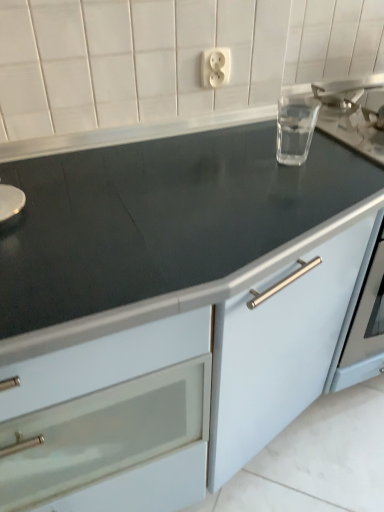
Find the location of `spots to the right of transparent glass at upper right`. spots to the right of transparent glass at upper right is located at coordinates (338, 164).